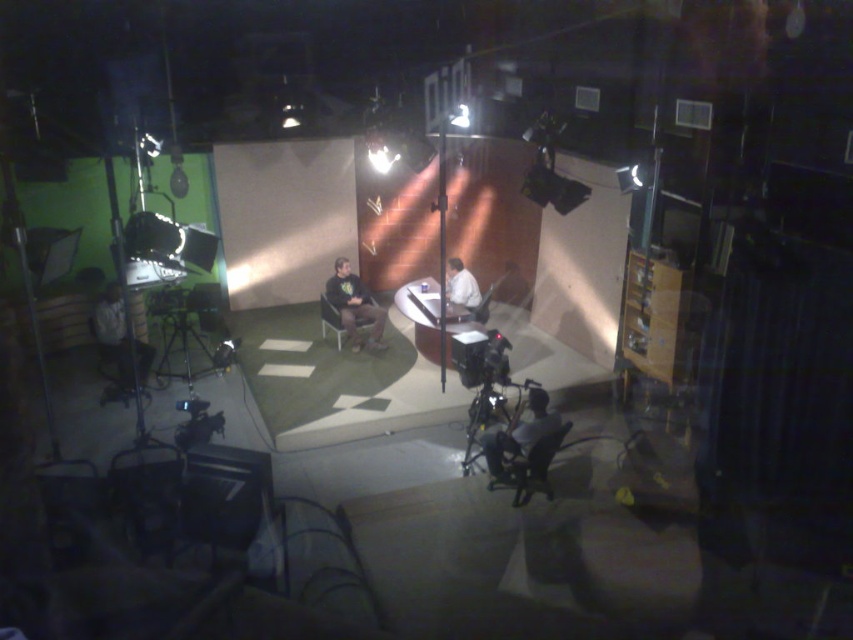
Between matte black chair at lower center and white fabric shirt at center, which one appears on the left side from the viewer's perspective?

white fabric shirt at center is more to the left.

Is matte black chair at lower center bigger than white fabric shirt at center?

Incorrect, matte black chair at lower center is not larger than white fabric shirt at center.

Between point (550, 497) and point (485, 312), which one is positioned behind?

Positioned behind is point (485, 312).

Identify the location of matte black chair at lower center. The width and height of the screenshot is (853, 640). (525, 465).

Is dark gray fabric chair at lower left smaller than matte black chair at center?

No.

Is point (93, 317) closer to camera compared to point (322, 336)?

Yes, it is.

Identify the location of dark gray fabric chair at lower left. (119, 340).

Is dark gray fabric chair at lower left positioned behind dark gray fabric chair at center?

That is False.

Is the position of dark gray fabric chair at lower left less distant than that of dark gray fabric chair at center?

Yes, dark gray fabric chair at lower left is closer to the viewer.

You are a GUI agent. You are given a task and a screenshot of the screen. Output one action in this format:
    pyautogui.click(x=<x>, y=<y>)
    Task: Click on the dark gray fabric chair at lower left
    The width and height of the screenshot is (853, 640).
    Given the screenshot: What is the action you would take?
    pyautogui.click(x=119, y=340)